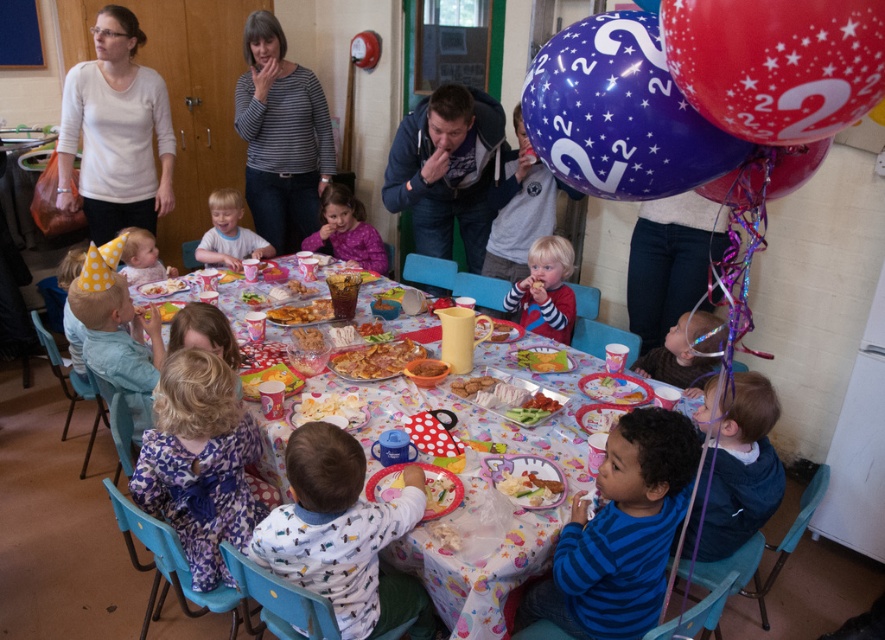
Who is more distant from viewer, (451, 212) or (319, 346)?

Positioned behind is point (451, 212).

Which is in front, point (447, 154) or point (310, 333)?

Point (310, 333) is in front.

At what (x,y) coordinates should I click in order to perform the action: click on blue denim jacket at center. Please return your answer as a coordinate pair (x, y). The height and width of the screenshot is (640, 885). Looking at the image, I should click on (447, 170).

Does white matte shirt at upper left have a larger size compared to striped shirt at upper center?

Actually, white matte shirt at upper left might be smaller than striped shirt at upper center.

Does point (133, 211) lie behind point (242, 113)?

No.

This screenshot has height=640, width=885. What are the coordinates of `white matte shirt at upper left` in the screenshot? It's located at point(116,131).

Describe the element at coordinates (529, 486) in the screenshot. I see `white glossy pasta at center` at that location.

Between white glossy pasta at center and crumbly golden cake at center, which one appears on the left side from the viewer's perspective?

Positioned to the left is crumbly golden cake at center.

Is point (519, 476) farther from viewer compared to point (321, 312)?

No.

Where is `white glossy pasta at center`? Image resolution: width=885 pixels, height=640 pixels. white glossy pasta at center is located at coordinates (529, 486).